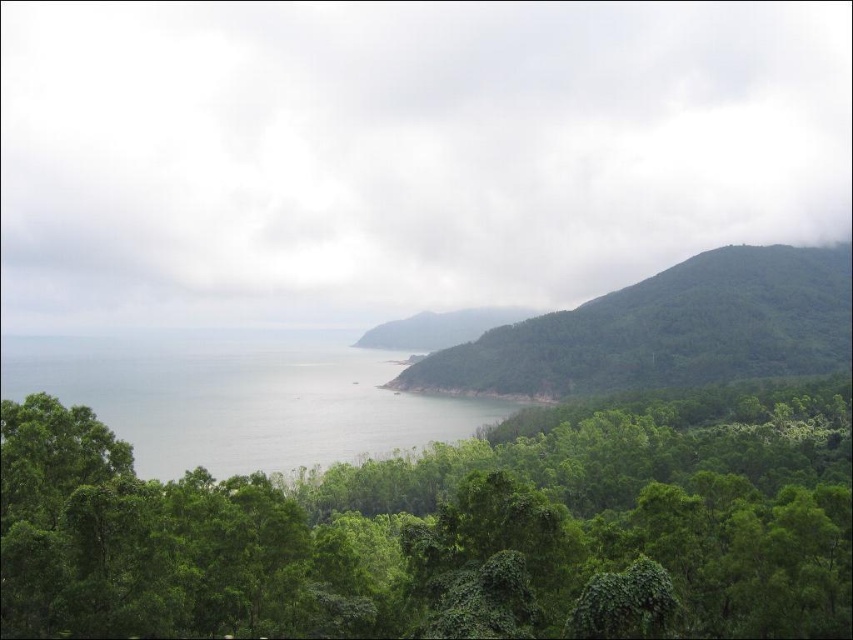
Question: Can you confirm if green leafy trees at center is positioned to the left of clear water at lower left?

Choices:
 (A) yes
 (B) no

Answer: (B)

Question: In this image, where is clear water at lower left located relative to green leafy hillside at right?

Choices:
 (A) above
 (B) below

Answer: (B)

Question: Which of the following is the closest to the observer?

Choices:
 (A) green leafy trees at center
 (B) green leafy hillside at right

Answer: (A)

Question: Which of the following is the farthest from the observer?

Choices:
 (A) clear water at lower left
 (B) green leafy hillside at center
 (C) green leafy trees at center

Answer: (B)

Question: Which is farther from the green leafy hillside at right?

Choices:
 (A) green leafy hillside at center
 (B) green leafy trees at center

Answer: (B)

Question: Is green leafy trees at center behind green leafy hillside at center?

Choices:
 (A) yes
 (B) no

Answer: (B)